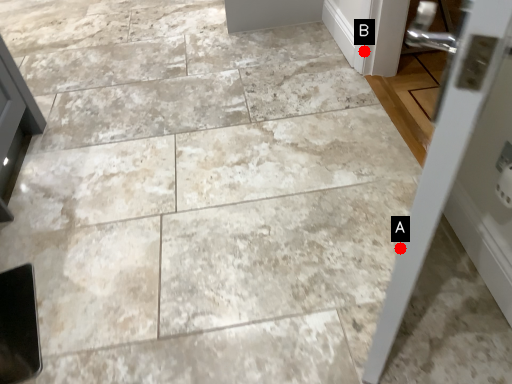
Question: Two points are circled on the image, labeled by A and B beside each circle. Which point appears farthest from the camera in this image?

Choices:
 (A) A is further
 (B) B is further

Answer: (B)